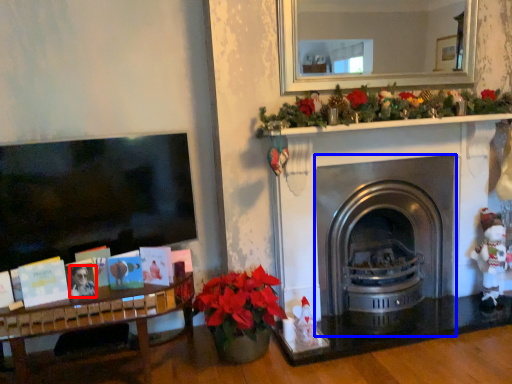
Question: Which point is closer to the camera, person (highlighted by a red box) or fireplace (highlighted by a blue box)?

Choices:
 (A) person
 (B) fireplace

Answer: (A)